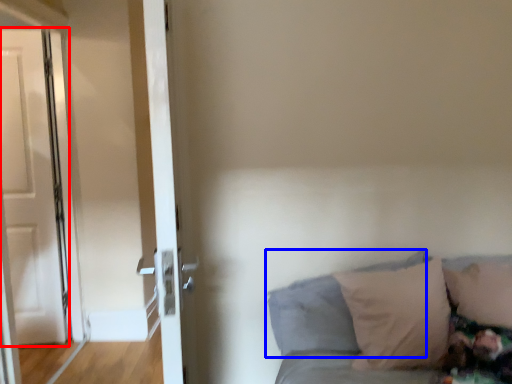
Question: Which object appears farthest to the camera in this image, door (highlighted by a red box) or pillow (highlighted by a blue box)?

Choices:
 (A) door
 (B) pillow

Answer: (A)